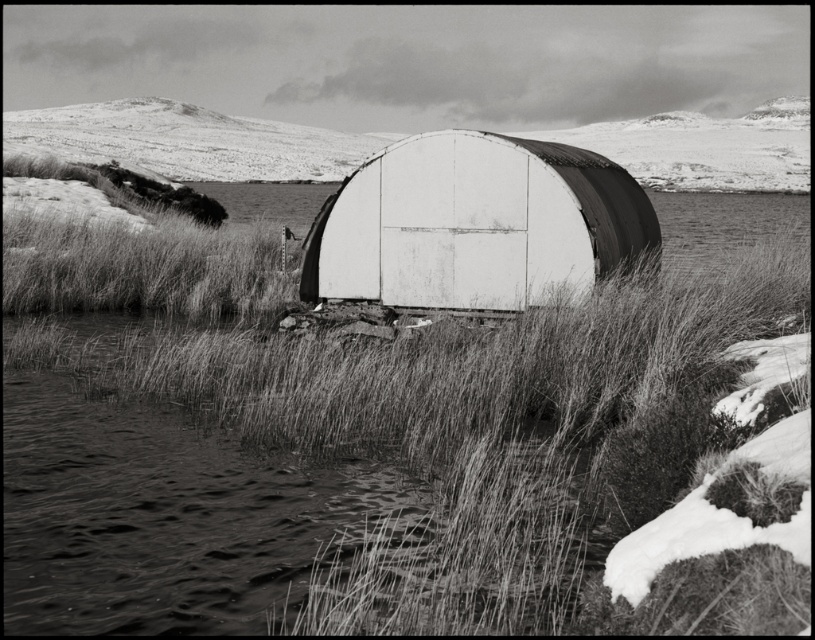
Which is more to the right, fuzzy grass at center or smooth white dome at center?

From the viewer's perspective, smooth white dome at center appears more on the right side.

Which is behind, point (214, 500) or point (56, 116)?

The point (56, 116) is behind.

Is point (750, 220) closer to viewer compared to point (399, 138)?

That is True.

You are a GUI agent. You are given a task and a screenshot of the screen. Output one action in this format:
    pyautogui.click(x=<x>, y=<y>)
    Task: Click on the fuzzy grass at center
    The image size is (815, 640).
    Given the screenshot: What is the action you would take?
    pyautogui.click(x=153, y=516)

Does white corrugated metal hut at center have a larger size compared to smooth white dome at center?

No, white corrugated metal hut at center is not bigger than smooth white dome at center.

Is white corrugated metal hut at center to the left of smooth white dome at center from the viewer's perspective?

Yes, white corrugated metal hut at center is to the left of smooth white dome at center.

Which is behind, point (557, 164) or point (232, 140)?

Point (232, 140)

At what (x,y) coordinates should I click in order to perform the action: click on white corrugated metal hut at center. Please return your answer as a coordinate pair (x, y). The height and width of the screenshot is (640, 815). Looking at the image, I should click on (474, 224).

Between fuzzy grass at center and white corrugated metal hut at center, which one has less height?

Standing shorter between the two is white corrugated metal hut at center.

Who is higher up, fuzzy grass at center or white corrugated metal hut at center?

fuzzy grass at center is above.

Where is `fuzzy grass at center`? The image size is (815, 640). fuzzy grass at center is located at coordinates (153, 516).

Identify the location of fuzzy grass at center. (153, 516).